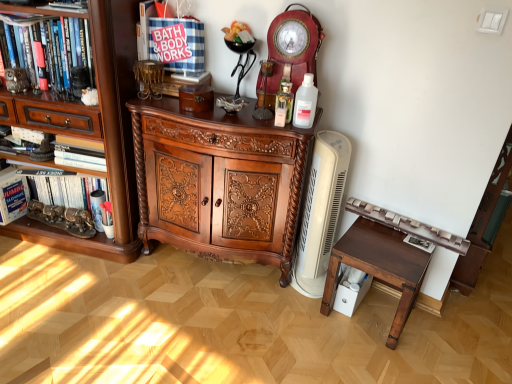
At what (x,y) coordinates should I click in order to perform the action: click on free spot below dark wood carved cabinet at center (from a real-world perspective). Please return your answer as a coordinate pair (x, y). This screenshot has width=512, height=384. Looking at the image, I should click on 216,266.